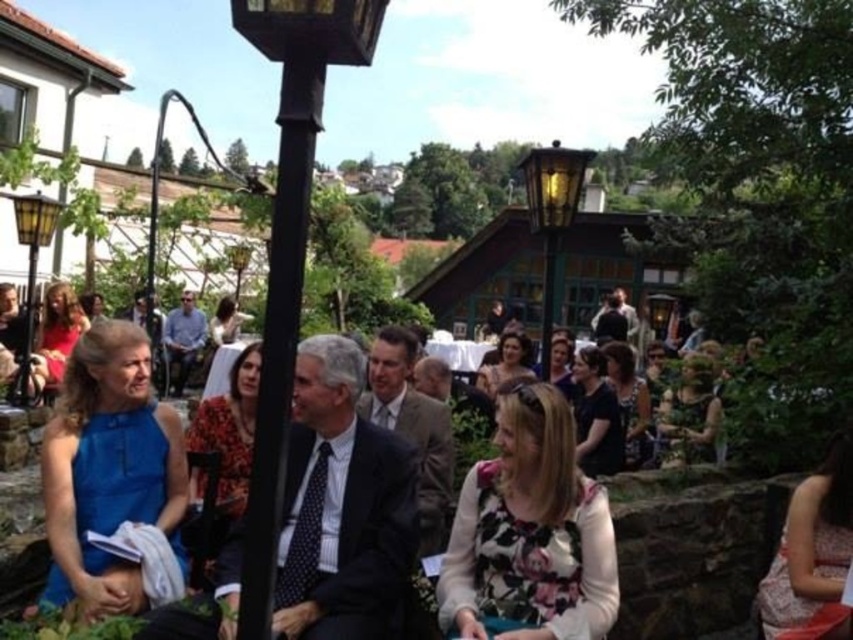
You are a photographer at the event and want to capture a photo of the blue satin dress at left and the matte black lamp post at center. Which object is shorter?

The blue satin dress at left is not as tall as the matte black lamp post at center, so the blue satin dress at left is shorter.

You are standing in the outdoor gathering area and want to locate both the black metal lamp post at center and the matte yellow lamp post at left. Which lamp post is positioned higher in the scene?

The black metal lamp post at center is positioned higher than the matte yellow lamp post at left in the scene.

You are organizing a photo shoot and need to ensure all subjects are visible in the frame. Given the floral fabric dress at center and the matte yellow lamp post at left, which object should be placed closer to the camera to maintain their relative sizes as seen in the image?

The floral fabric dress at center should be placed closer to the camera because it has a smaller size compared to the matte yellow lamp post at left, so moving it closer would help maintain their size relationship as seen in the image.